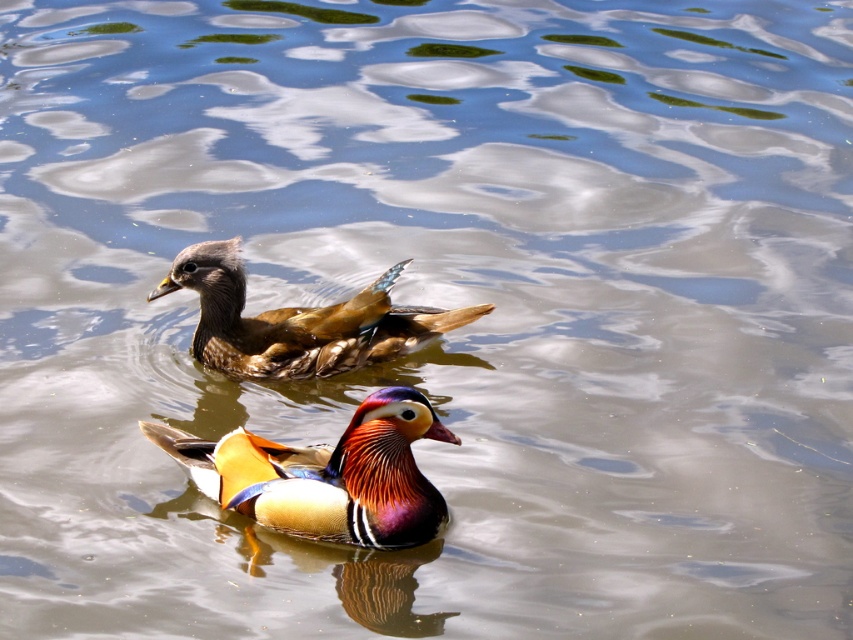
Question: Which point is farther from the camera taking this photo?

Choices:
 (A) (383, 339)
 (B) (331, 474)

Answer: (A)

Question: Considering the relative positions of shiny multicolored duck at center and brown matte duck at upper center in the image provided, where is shiny multicolored duck at center located with respect to brown matte duck at upper center?

Choices:
 (A) below
 (B) above

Answer: (A)

Question: Which point is farther from the camera taking this photo?

Choices:
 (A) (415, 502)
 (B) (360, 300)

Answer: (B)

Question: Where is shiny multicolored duck at center located in relation to brown matte duck at upper center in the image?

Choices:
 (A) below
 (B) above

Answer: (A)

Question: Which point is closer to the camera taking this photo?

Choices:
 (A) (489, 307)
 (B) (405, 538)

Answer: (B)

Question: Is shiny multicolored duck at center above brown matte duck at upper center?

Choices:
 (A) yes
 (B) no

Answer: (B)